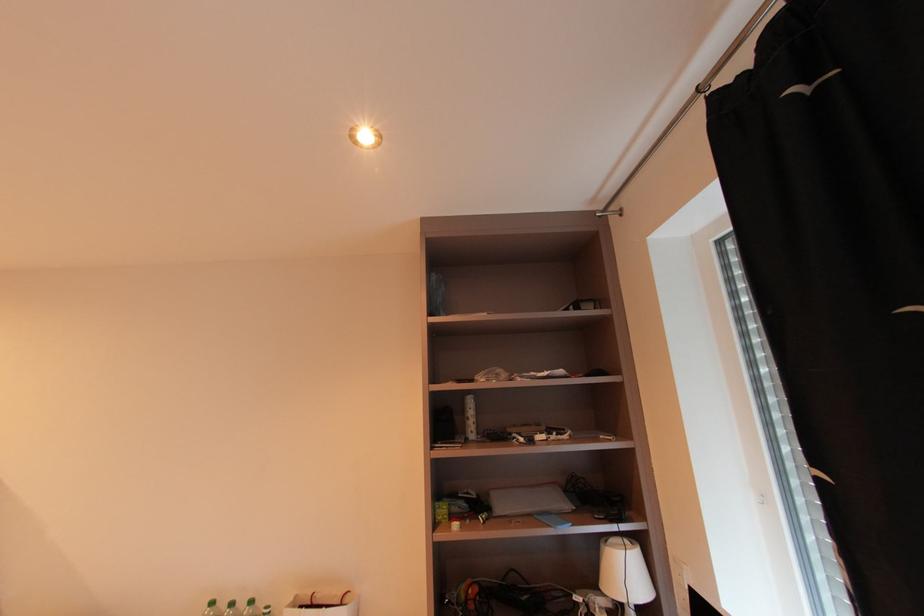
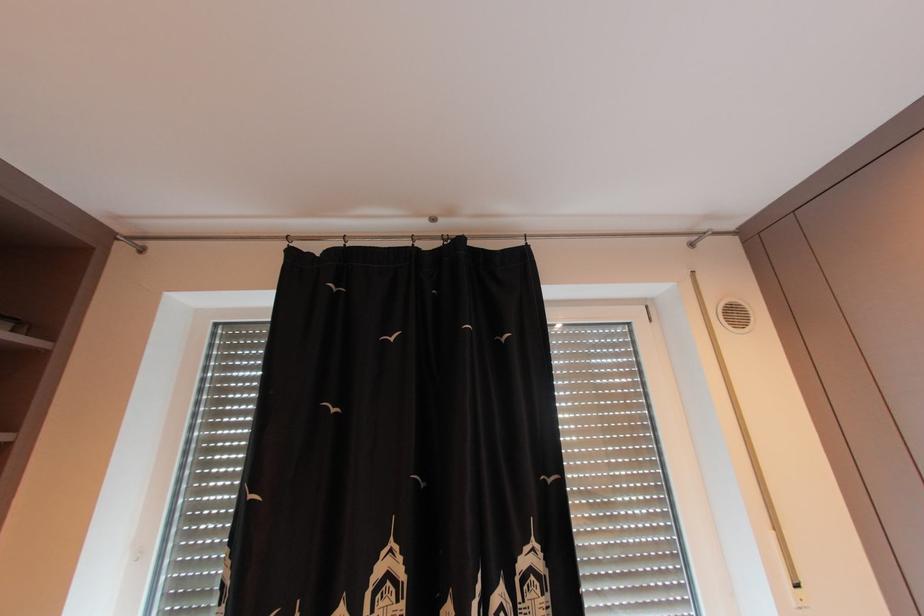
First-person continuous shooting, in which direction is the camera rotating?

The rotation direction of the camera is right-up.